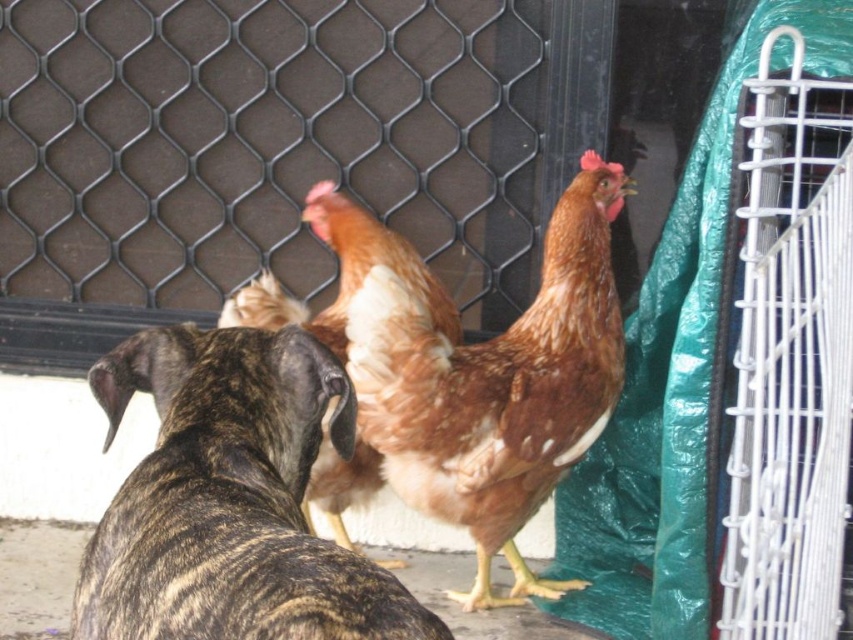
Measure the distance from brindle fur dog at center to brown feathered chicken at center.

The distance of brindle fur dog at center from brown feathered chicken at center is 28.43 inches.

Which of these two, brindle fur dog at center or brown feathered chicken at center, stands taller?

Standing taller between the two is brown feathered chicken at center.

Does point (219, 524) come closer to viewer compared to point (547, 392)?

That is True.

Where is `brindle fur dog at center`? The width and height of the screenshot is (853, 640). brindle fur dog at center is located at coordinates point(239,513).